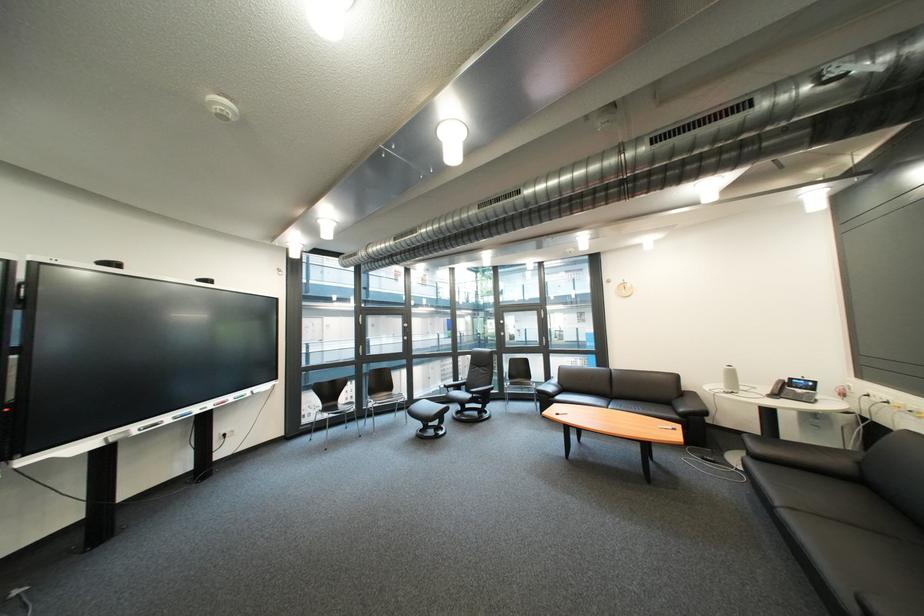
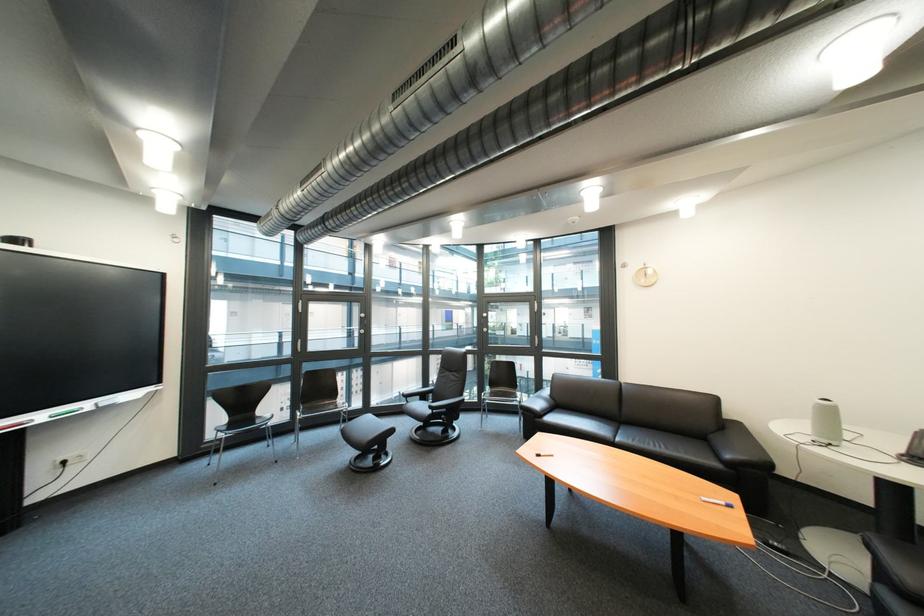
In the second image, find the point that corresponds to pixel 338 411 in the first image.

(246, 426)